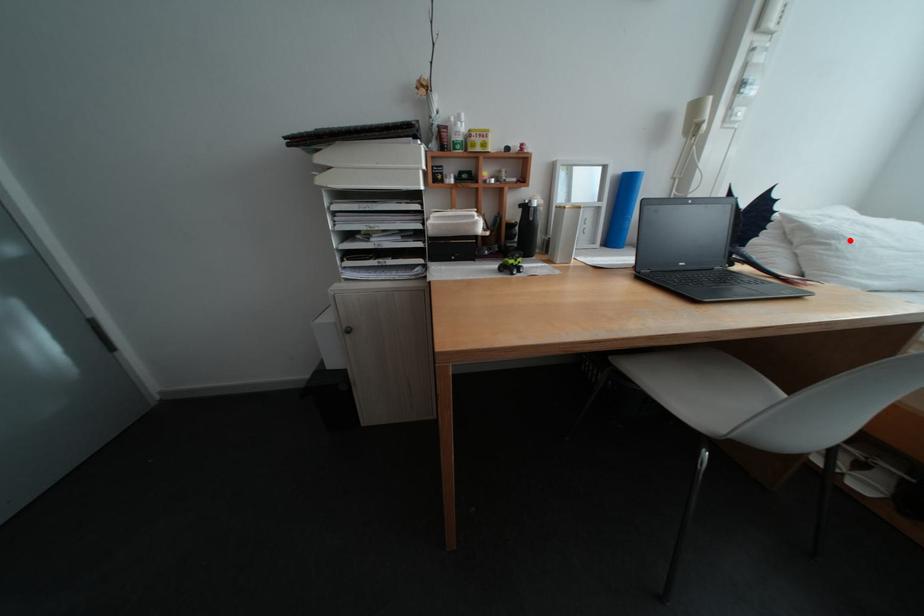
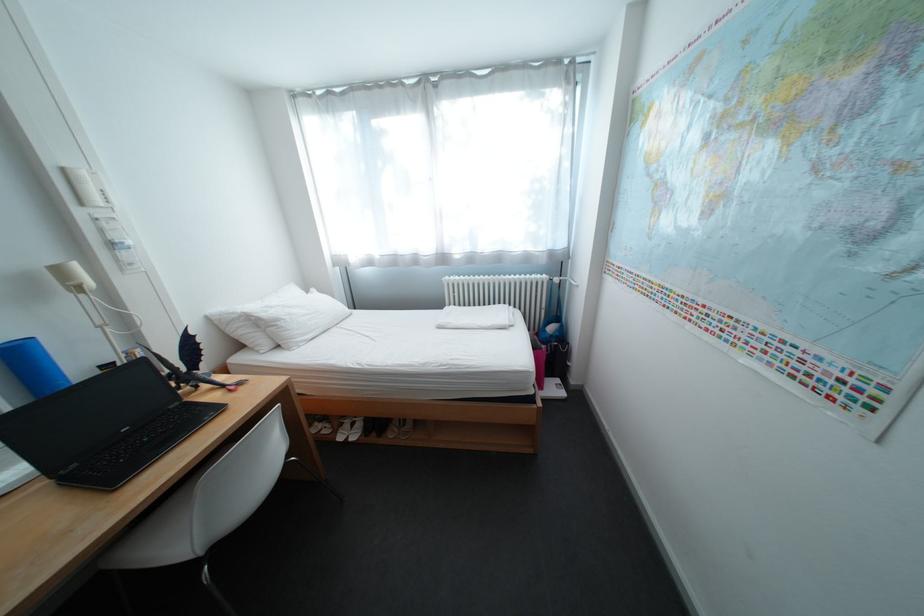
Question: I am providing you with two images of the same scene from different viewpoints. In image1, a red point is highlighted. Considering the same 3D point in image2, which of the following is correct?

Choices:
 (A) It is closer
 (B) It is farther

Answer: (A)